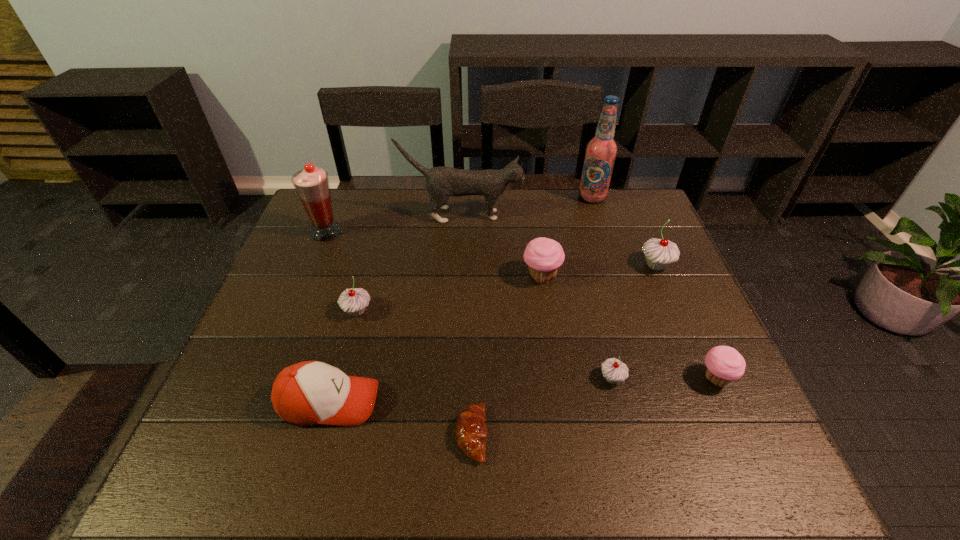
Where is `object that is at the near edge`? This screenshot has height=540, width=960. object that is at the near edge is located at coordinates (471, 431).

The height and width of the screenshot is (540, 960). I want to click on smoothie that is at the left edge, so click(312, 186).

At what (x,y) coordinates should I click in order to perform the action: click on baseball cap that is at the left edge. Please return your answer as a coordinate pair (x, y). Looking at the image, I should click on (311, 392).

This screenshot has height=540, width=960. Identify the location of alcohol present at the right edge. click(601, 151).

I want to click on object situated at the far left corner, so click(312, 186).

Locate an element on the screen. object located at the far right corner is located at coordinates (601, 151).

In order to click on vacant area at the far edge in this screenshot , I will do `click(363, 221)`.

Find the location of a particular element. This screenshot has height=540, width=960. blank area at the near edge is located at coordinates (621, 477).

Identify the location of free space at the left edge of the desktop. Image resolution: width=960 pixels, height=540 pixels. (288, 318).

This screenshot has height=540, width=960. I want to click on vacant position at the right edge of the desktop, so click(692, 330).